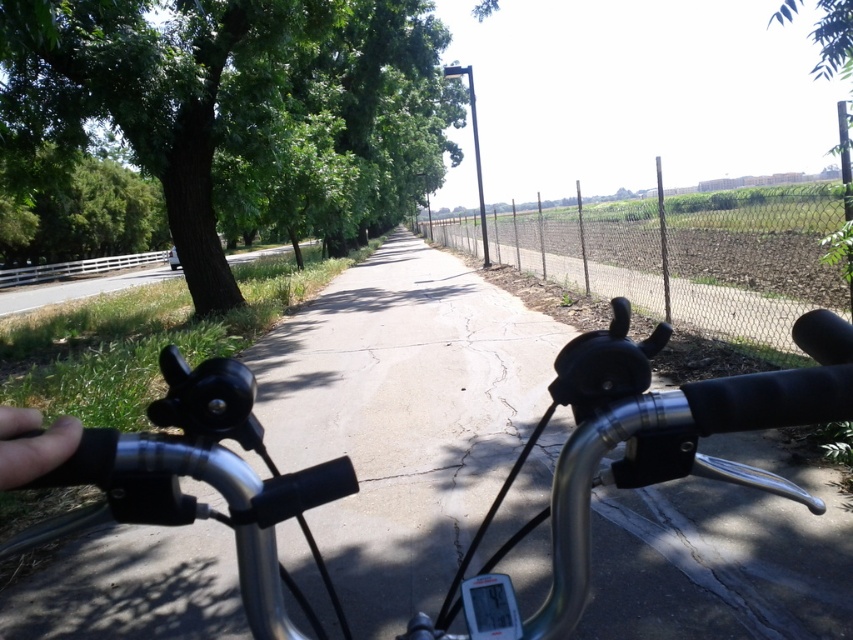
You are riding a bicycle and see the green leafy tree at left and the skinny finger at lower left. Which object is higher from the ground?

The green leafy tree at left is above the skinny finger at lower left, so the green leafy tree at left is higher from the ground.